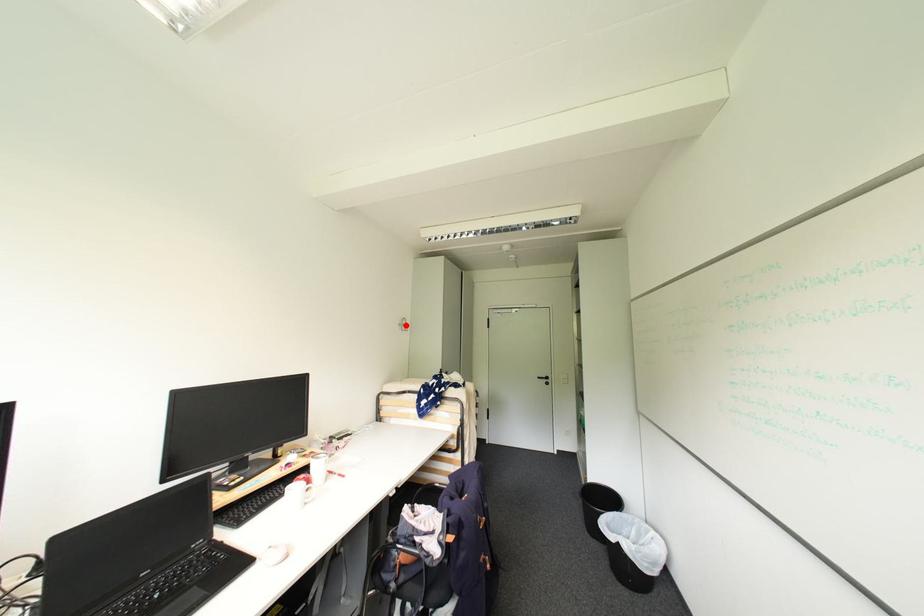
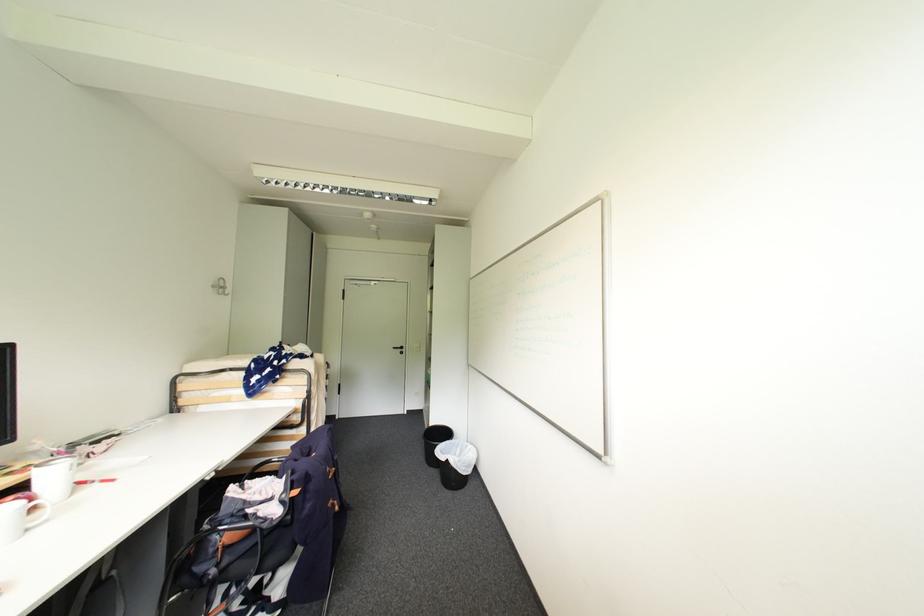
In the second image, find the point that corresponds to the highlighted location in the first image.

(220, 286)